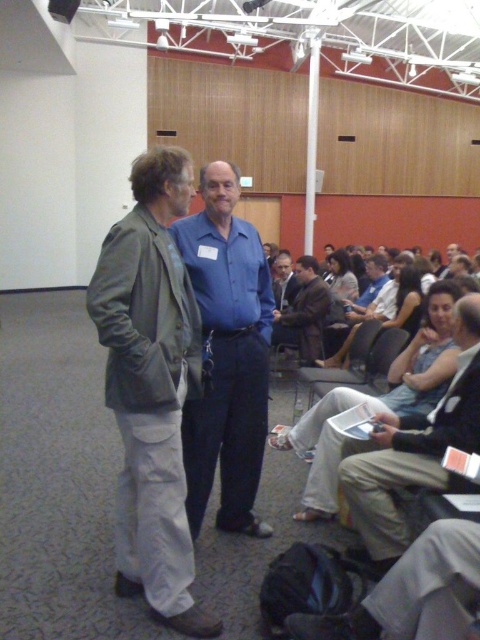
Based on the photo, is matte blue shirt at center thinner than light blue shirt at center?

Yes.

Does matte blue shirt at center appear on the left side of light blue shirt at center?

Correct, you'll find matte blue shirt at center to the left of light blue shirt at center.

Image resolution: width=480 pixels, height=640 pixels. What do you see at coordinates (284, 280) in the screenshot?
I see `matte blue shirt at center` at bounding box center [284, 280].

At what (x,y) coordinates should I click in order to perform the action: click on matte blue shirt at center. Please return your answer as a coordinate pair (x, y). This screenshot has width=480, height=640. Looking at the image, I should click on tap(284, 280).

Is blue smooth shirt at center closer to the viewer compared to matte blue shirt at center?

Yes, it is.

Based on the photo, is blue smooth shirt at center behind matte blue shirt at center?

No, it is not.

This screenshot has height=640, width=480. In order to click on blue smooth shirt at center in this screenshot , I will do `click(227, 355)`.

Does blue smooth shirt at center have a greater height compared to light blue shirt at center?

Correct, blue smooth shirt at center is much taller as light blue shirt at center.

Is point (230, 362) positioned behind point (334, 252)?

No.

Who is more forward, (252, 339) or (335, 252)?

Point (252, 339)

Identify the location of blue smooth shirt at center. (227, 355).